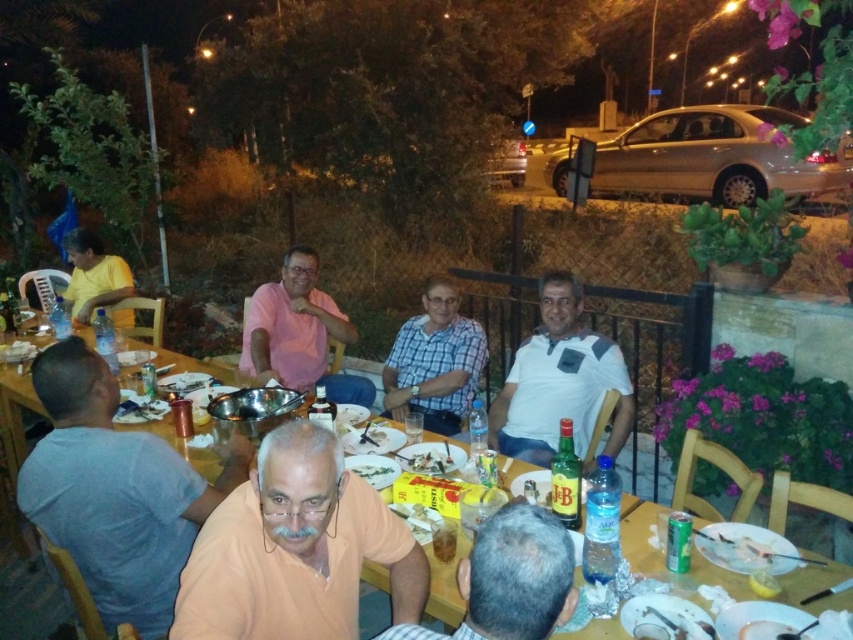
You are a guest at this outdoor dinner and want to reach for your plate. Which plate, the white glossy plate at center or the white paper plate at center, is closer to you?

The white glossy plate at center is closer to you since the white paper plate at center is behind it.

You are a waiter at this outdoor table and need to deliver a drink to the person wearing the pink matte shirt at center. However, there is a white paper plate at center on the table. Will you have to move the plate to reach the shirt?

The pink matte shirt at center is further to the viewer than the white paper plate at center, meaning the shirt is closer to you. Therefore, you don not need to move the plate to reach the shirt.